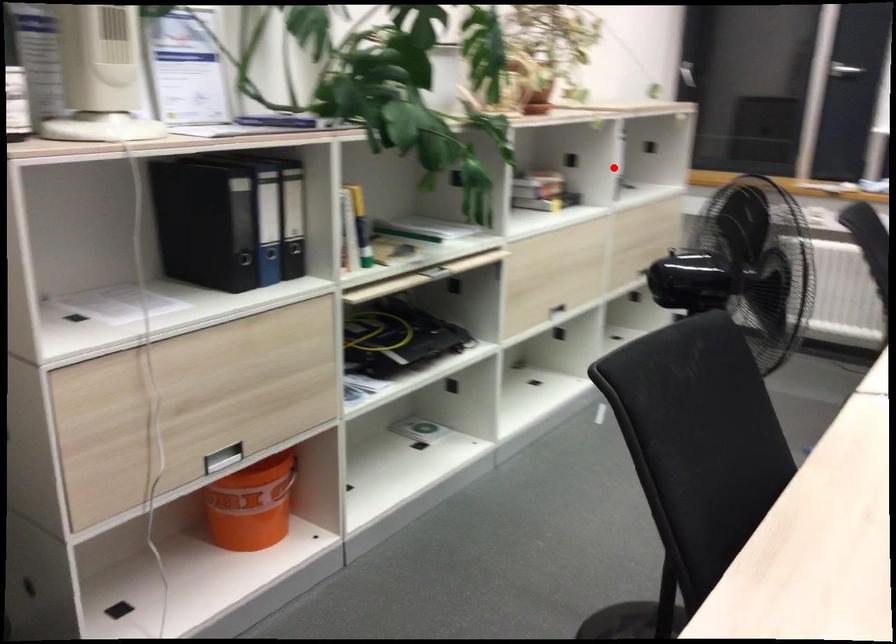
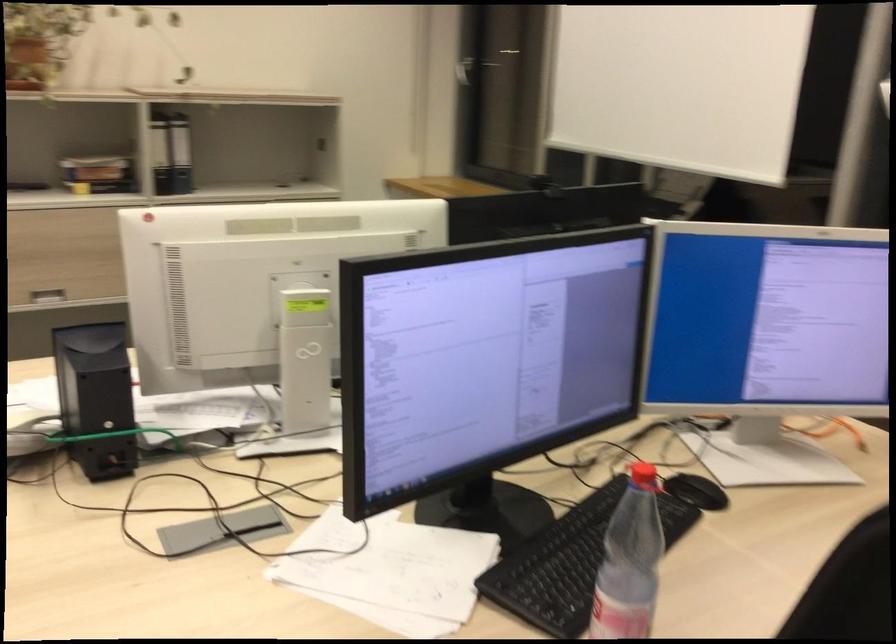
Locate, in the second image, the point that corresponds to the highlighted location in the first image.

(160, 153)